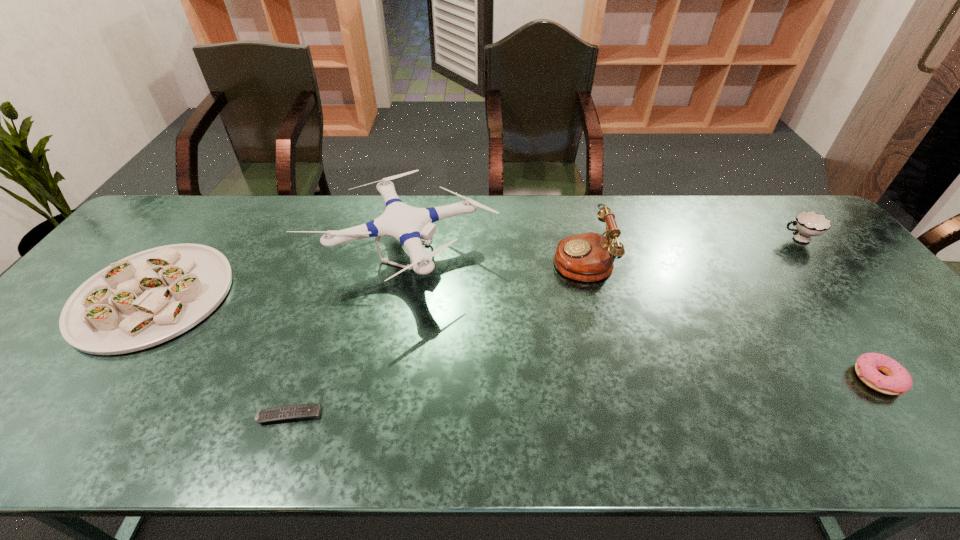
Image resolution: width=960 pixels, height=540 pixels. What are the coordinates of `free location at the right edge of the desktop` in the screenshot? It's located at (851, 279).

Identify the location of vacant space at the far right corner. This screenshot has width=960, height=540. (773, 201).

The height and width of the screenshot is (540, 960). I want to click on free area in between the drone and the telephone, so click(492, 257).

Identify the location of unoccupied position between the platter and the fifth tallest object. (515, 337).

Locate an element on the screen. The image size is (960, 540). empty location between the telephone and the leftmost object is located at coordinates (368, 277).

What are the coordinates of `vacant area that lies between the third object from right to left and the remote control` in the screenshot? It's located at (436, 337).

At what (x,y) coordinates should I click in order to perform the action: click on vacant space that's between the fourth object from left to right and the platter. Please return your answer as a coordinate pair (x, y). This screenshot has width=960, height=540. Looking at the image, I should click on (368, 277).

Where is `vacant space in between the fifth tallest object and the leftmost object`? The image size is (960, 540). vacant space in between the fifth tallest object and the leftmost object is located at coordinates (515, 337).

Find the location of a particular element. vacant area that lies between the third object from right to left and the doughnut is located at coordinates (730, 318).

The height and width of the screenshot is (540, 960). Find the location of `vacant area between the fourth tallest object and the second nearest object`. vacant area between the fourth tallest object and the second nearest object is located at coordinates (515, 337).